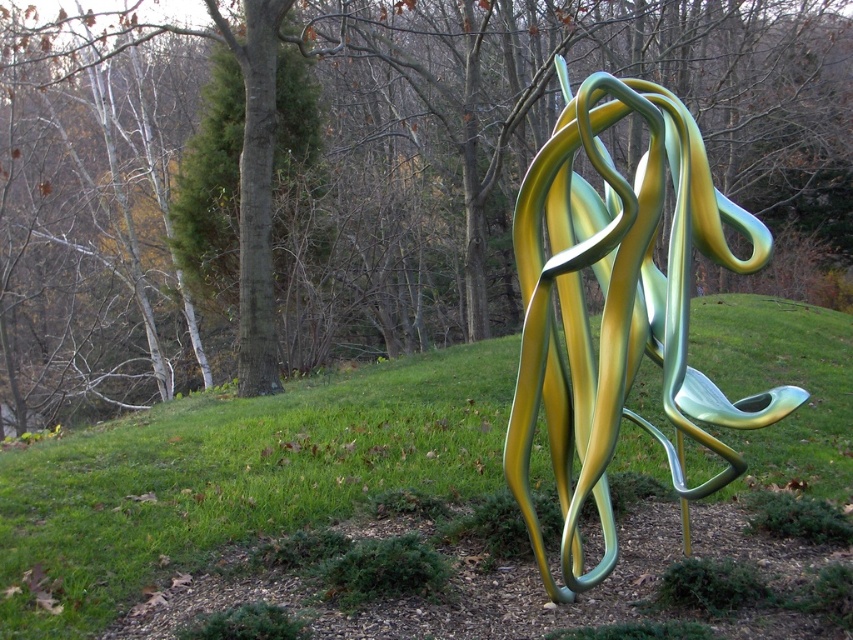
From the picture: Measure the distance from green matte tree at center to metallic green and yellow sculpture at center.

green matte tree at center is 8.65 meters from metallic green and yellow sculpture at center.

Who is more distant from viewer, (456, 253) or (550, 260)?

Point (456, 253)

I want to click on green matte tree at center, so click(x=518, y=144).

Between green matte tree at center and green grass at center, which one appears on the right side from the viewer's perspective?

green grass at center is more to the right.

Is point (117, 257) less distant than point (502, 346)?

No, it is behind (502, 346).

This screenshot has height=640, width=853. In order to click on green matte tree at center in this screenshot , I will do `click(518, 144)`.

Does green grass at center lie behind metallic green and yellow sculpture at center?

Yes, green grass at center is behind metallic green and yellow sculpture at center.

Consider the image. Does green grass at center have a greater width compared to metallic green and yellow sculpture at center?

Yes.

Is point (209, 484) positioned before point (727, 253)?

That is False.

Identify the location of green grass at center. (x=238, y=474).